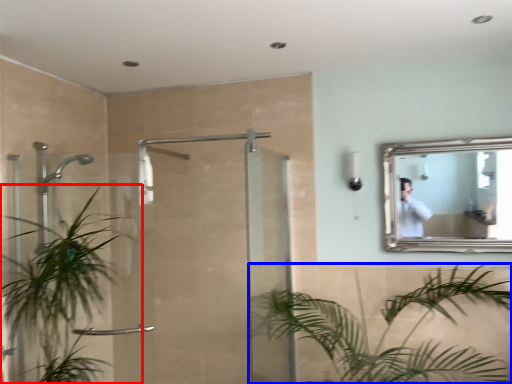
Question: Which object is further to the camera taking this photo, houseplant (highlighted by a red box) or houseplant (highlighted by a blue box)?

Choices:
 (A) houseplant
 (B) houseplant

Answer: (A)